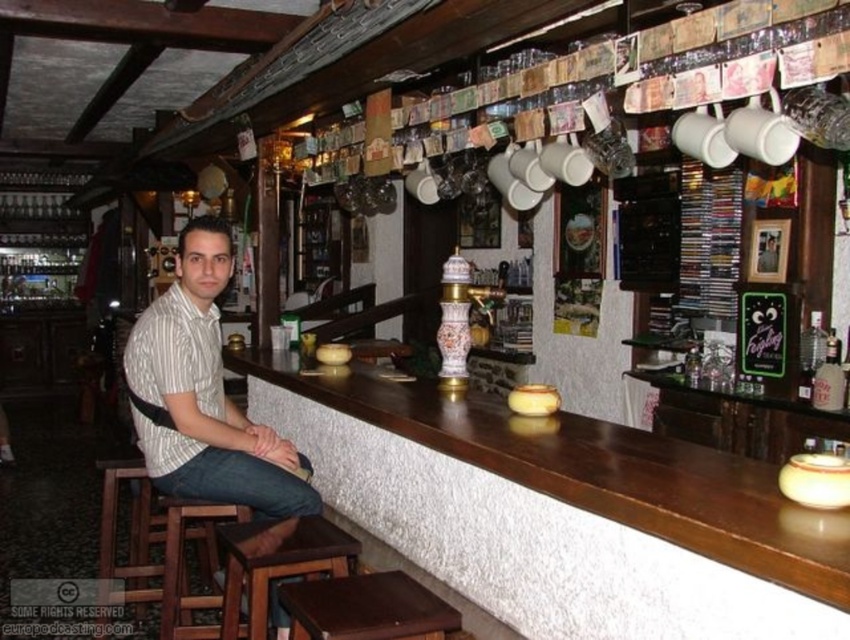
Is point (315, 620) closer to viewer compared to point (255, 637)?

Yes.

Between dark brown wood bar stool at lower center and brown wooden bar stool at lower left, which one appears on the right side from the viewer's perspective?

Positioned to the right is dark brown wood bar stool at lower center.

Between point (401, 620) and point (267, 582), which one is positioned in front?

Positioned in front is point (401, 620).

The image size is (850, 640). What are the coordinates of `dark brown wood bar stool at lower center` in the screenshot? It's located at (366, 609).

Can you confirm if white striped shirt at center is thinner than dark brown wood bar stool at lower center?

In fact, white striped shirt at center might be wider than dark brown wood bar stool at lower center.

Which is behind, point (224, 490) or point (292, 609)?

Positioned behind is point (224, 490).

What do you see at coordinates (204, 396) in the screenshot? This screenshot has height=640, width=850. I see `white striped shirt at center` at bounding box center [204, 396].

Locate an element on the screen. white striped shirt at center is located at coordinates (204, 396).

Describe the element at coordinates (366, 609) in the screenshot. The width and height of the screenshot is (850, 640). I see `dark brown wood bar stool at lower center` at that location.

Does point (417, 621) come behind point (168, 589)?

No.

Locate an element on the screen. This screenshot has height=640, width=850. dark brown wood bar stool at lower center is located at coordinates (366, 609).